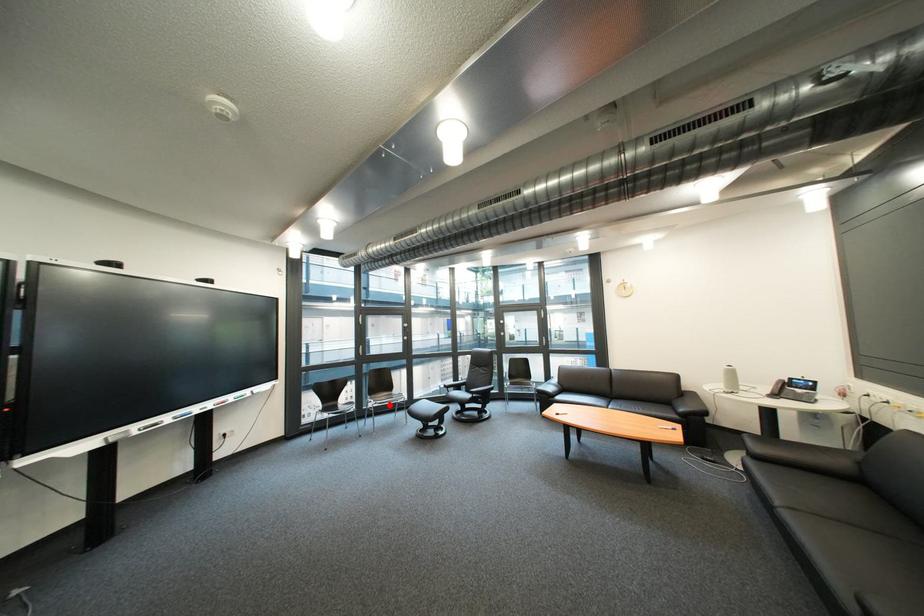
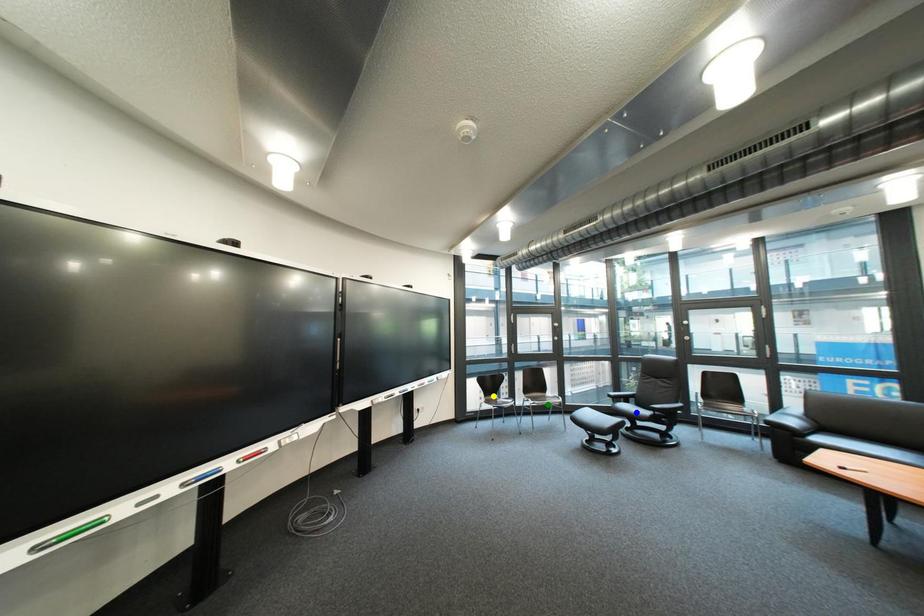
Question: I am providing you with two images of the same scene from different viewpoints. A red point is marked on the first image. You are given multiple points on the second image. Can you choose the point in image 2 that corresponds to the point in image 1?

Choices:
 (A) yellow point
 (B) green point
 (C) blue point

Answer: (B)